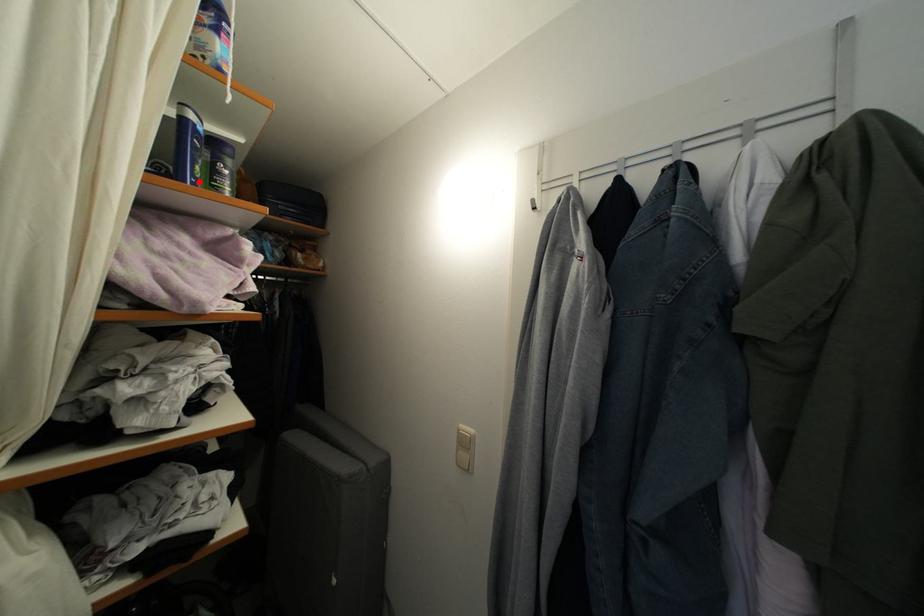
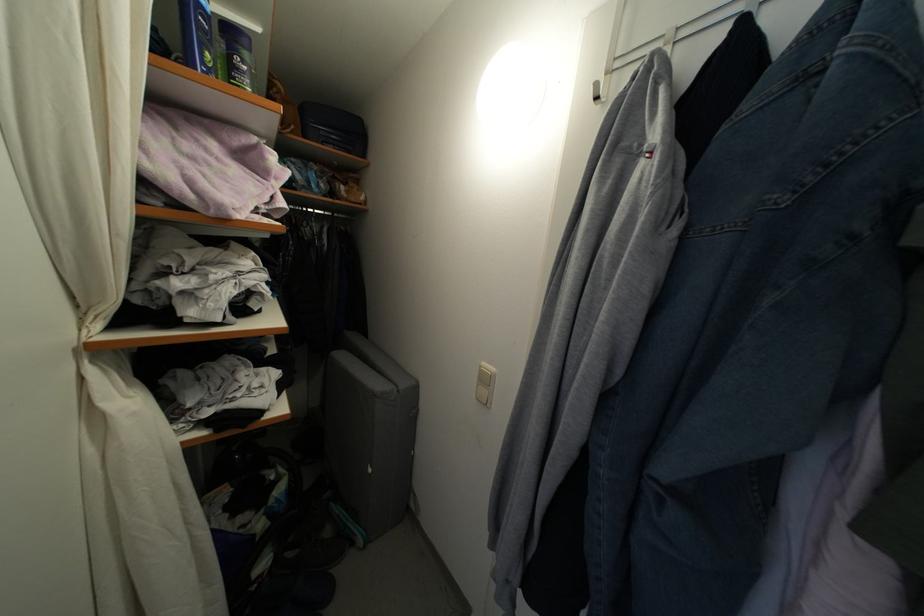
Locate, in the second image, the point that corresponds to the highlighted location in the first image.

(210, 70)